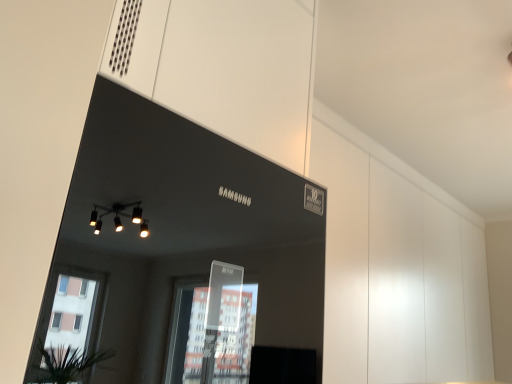
Describe the element at coordinates (397, 275) in the screenshot. Image resolution: width=512 pixels, height=384 pixels. I see `matte black tv at upper center` at that location.

Locate an element on the screen. matte black tv at upper center is located at coordinates (397, 275).

The height and width of the screenshot is (384, 512). In order to click on matte black tv at upper center in this screenshot , I will do (397, 275).